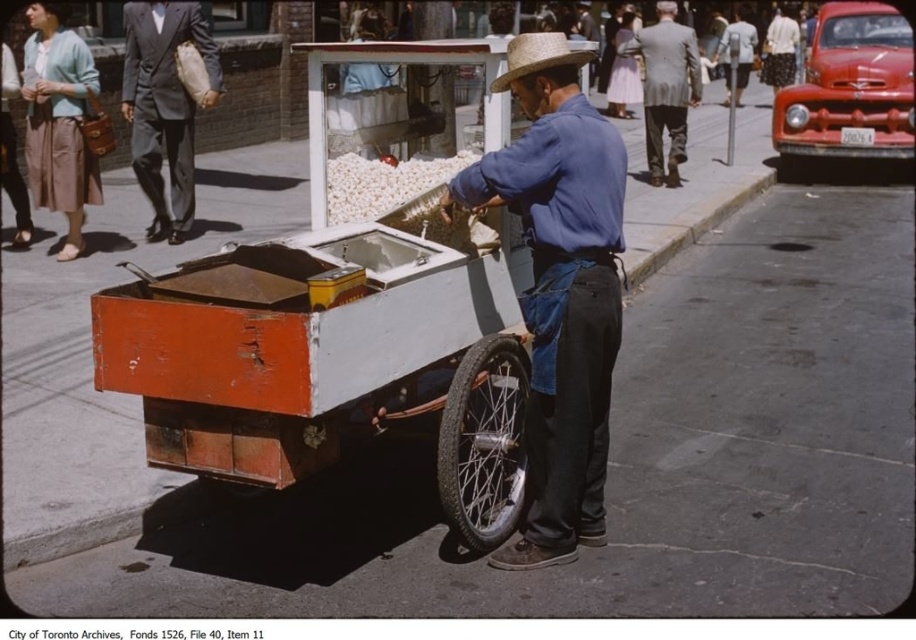
Who is more distant from viewer, (x=660, y=166) or (x=375, y=177)?

The point (x=660, y=166) is behind.

Who is positioned more to the right, gray wool suit at upper center or white fluffy popcorn at center?

gray wool suit at upper center is more to the right.

Which is behind, point (685, 35) or point (396, 177)?

The point (685, 35) is behind.

Identify the location of gray wool suit at upper center. (666, 88).

What do you see at coordinates (334, 337) in the screenshot? The height and width of the screenshot is (640, 916). I see `rusty metal cart at center` at bounding box center [334, 337].

Is rusty metal cart at center positioned behind matte blue shirt at center?

No, rusty metal cart at center is in front of matte blue shirt at center.

Between point (516, 336) and point (728, 97), which one is positioned behind?

Point (728, 97)

The width and height of the screenshot is (916, 640). I want to click on rusty metal cart at center, so click(334, 337).

Which is behind, point (284, 452) or point (466, 465)?

Positioned behind is point (466, 465).

Does rusty metal cart at center appear on the left side of rubber/textured tire at lower center?

Indeed, rusty metal cart at center is positioned on the left side of rubber/textured tire at lower center.

Does point (409, 291) come in front of point (520, 381)?

Yes, point (409, 291) is closer to viewer.

In order to click on rusty metal cart at center in this screenshot , I will do `click(334, 337)`.